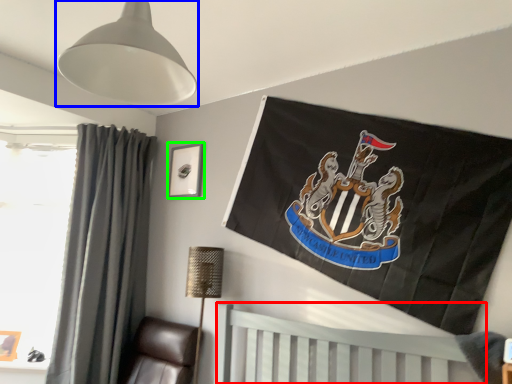
Question: Which object is positioned closest to furniture (highlighted by a red box)? Select from lamp (highlighted by a blue box) and picture frame (highlighted by a green box).

Choices:
 (A) lamp
 (B) picture frame

Answer: (B)